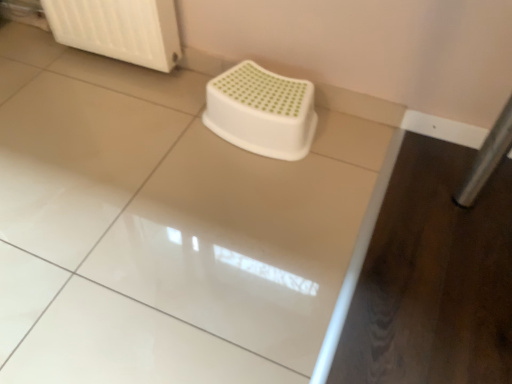
Where is `vacant space that is to the left of white plastic stool at center`? vacant space that is to the left of white plastic stool at center is located at coordinates (162, 132).